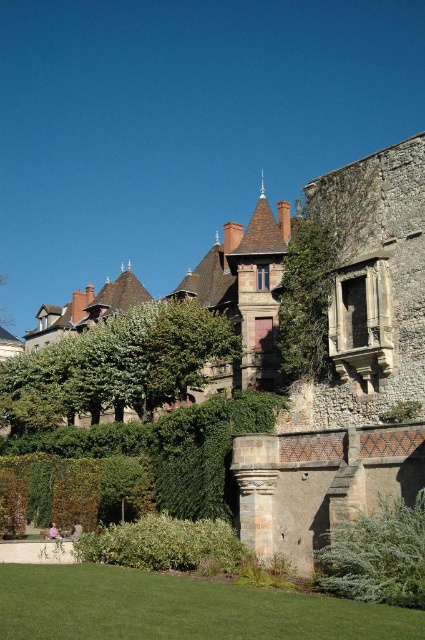
Does green leafy hedge at center have a lesser width compared to green leafy hedge at lower center?

Incorrect, green leafy hedge at center's width is not less than green leafy hedge at lower center's.

Which is below, green leafy hedge at center or green leafy hedge at lower center?

green leafy hedge at lower center is lower down.

Looking at this image, who is more forward, (x=164, y=312) or (x=141, y=518)?

Positioned in front is point (x=141, y=518).

Image resolution: width=425 pixels, height=640 pixels. Find the location of `green leafy hedge at center`. green leafy hedge at center is located at coordinates (116, 365).

Who is more forward, [413,468] or [283,602]?

Point [283,602]

Based on the photo, does brown stone castle at upper center appear over green grass at lower center?

Yes, brown stone castle at upper center is above green grass at lower center.

Who is more distant from viewer, (204, 392) or (107, 568)?

Positioned behind is point (204, 392).

Locate an element on the screen. The width and height of the screenshot is (425, 640). brown stone castle at upper center is located at coordinates click(350, 369).

Is green leafy hedge at lower right wider than green leafy hedge at lower center?

No.

Is green leafy hedge at lower right further to the viewer compared to green leafy hedge at lower center?

No.

Where is `green leafy hedge at lower right`? green leafy hedge at lower right is located at coordinates (376, 556).

Where is `green leafy hedge at lower right`? This screenshot has height=640, width=425. green leafy hedge at lower right is located at coordinates (376, 556).